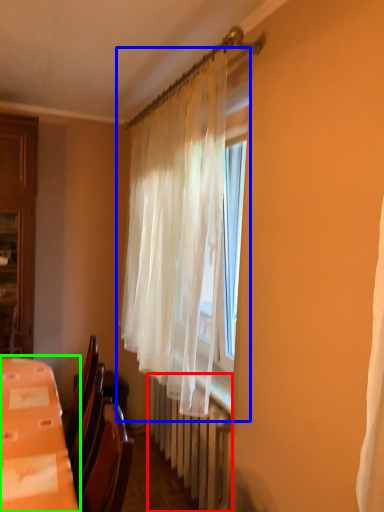
Question: Which object is positioned closest to radiator (highlighted by a red box)? Select from curtain (highlighted by a blue box) and table (highlighted by a green box).

Choices:
 (A) curtain
 (B) table

Answer: (A)